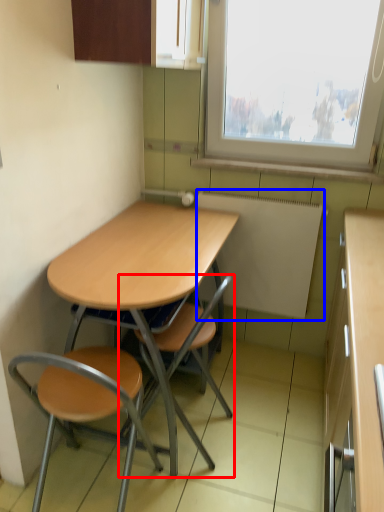
Question: Which object is closer to the camera taking this photo, chair (highlighted by a red box) or appliance (highlighted by a blue box)?

Choices:
 (A) chair
 (B) appliance

Answer: (A)